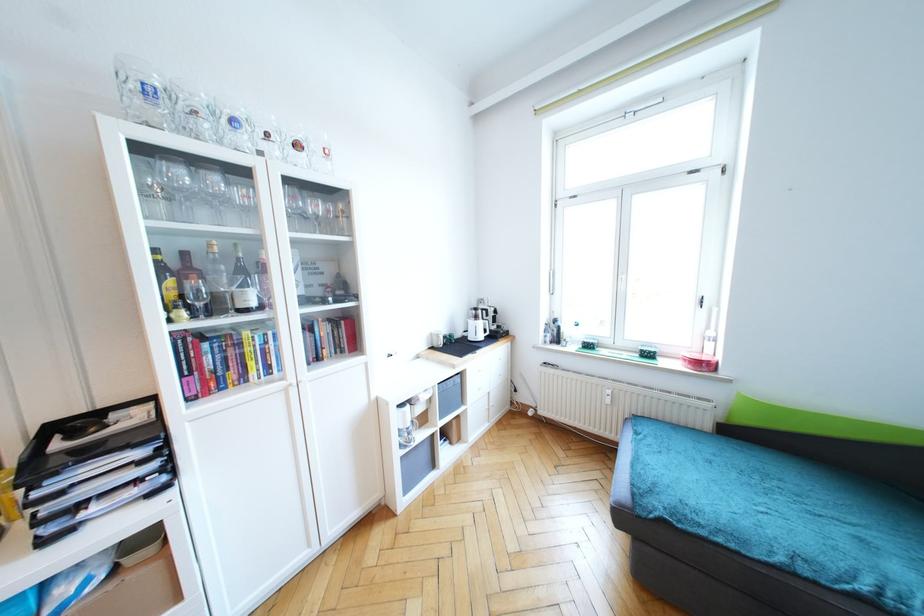
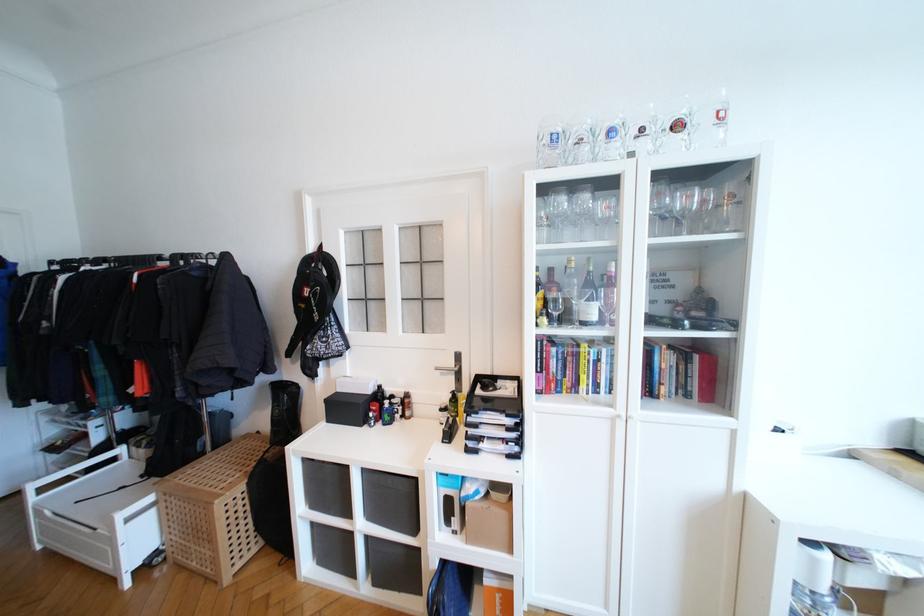
In the second image, find the point that corresponds to point 271,310 in the first image.

(611, 326)